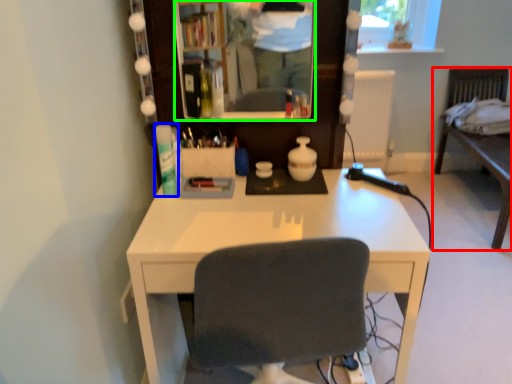
Question: Estimate the real-world distances between objects in this image. Which object is farther from furniture (highlighted by a red box), toiletry (highlighted by a blue box) or mirror (highlighted by a green box)?

Choices:
 (A) toiletry
 (B) mirror

Answer: (A)